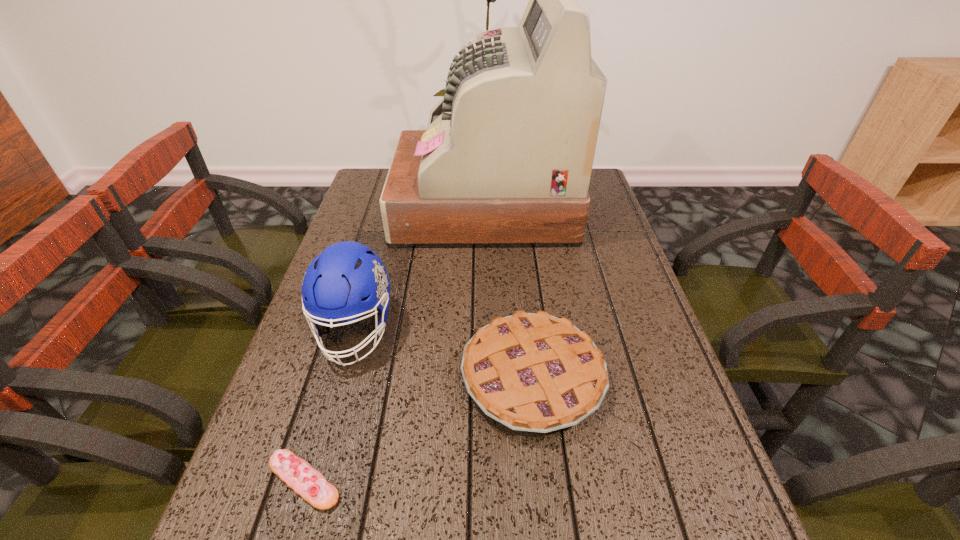
I want to click on free space that satisfies the following two spatial constraints: 1. on the back side of the nearest object; 2. on the right side of the pie, so click(x=335, y=378).

Locate an element on the screen. This screenshot has height=540, width=960. blank area in the image that satisfies the following two spatial constraints: 1. on the operating side of the farthest object; 2. on the face guard of the football helmet is located at coordinates (485, 330).

This screenshot has height=540, width=960. Find the location of `vacant space that satisfies the following two spatial constraints: 1. on the operating side of the pie; 2. on the right side of the cash register`. vacant space that satisfies the following two spatial constraints: 1. on the operating side of the pie; 2. on the right side of the cash register is located at coordinates (486, 378).